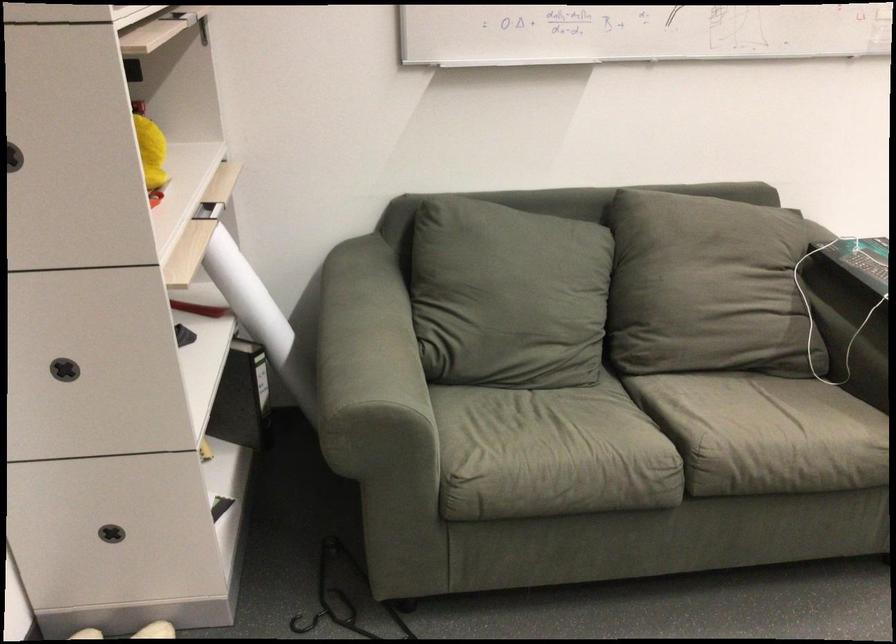
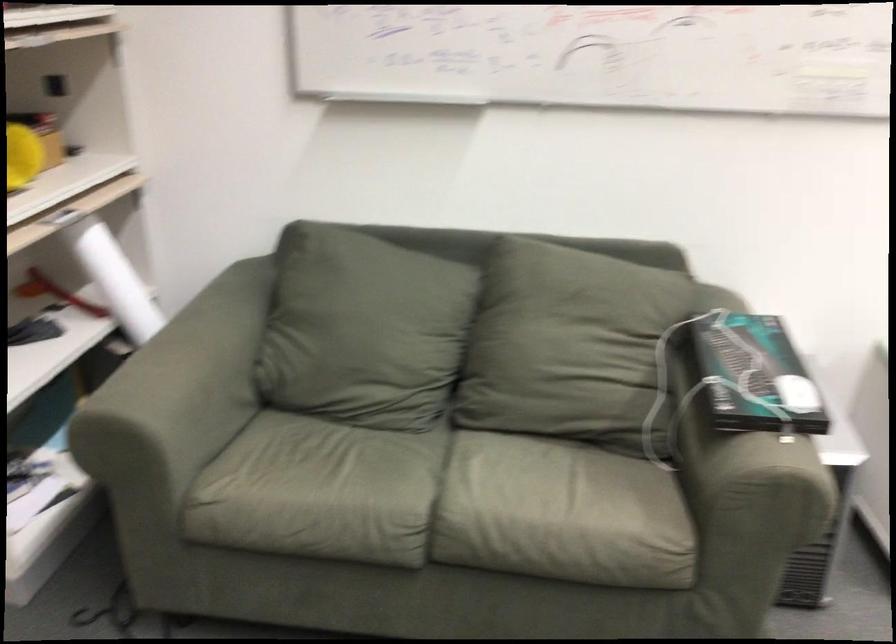
Question: In a continuous first-person perspective shot, in which direction is the camera moving?

Choices:
 (A) Left
 (B) Right
 (C) Forward
 (D) Backward

Answer: (B)